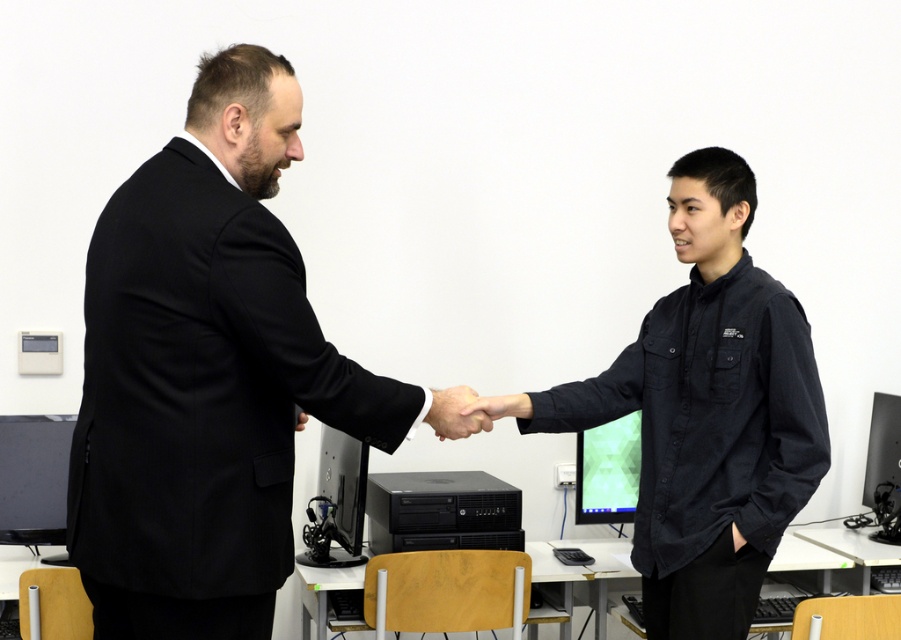
You are setting up a presentation and need to choose between the green matte computer monitor at center and the black glossy computer monitor at right. Which monitor should you choose if you want the one with a bigger screen?

The green matte computer monitor at center has a larger size compared to the black glossy computer monitor at right, so you should choose the green matte computer monitor at center for a bigger screen.

You are standing in the room and want to move from the point at coordinates point [678,392] to the point at coordinates point [448,403]. Can you walk directly between them without any obstacles?

Point [678,392] is behind point [448,403], so you cannot walk directly between them without going around the obstacle in front.